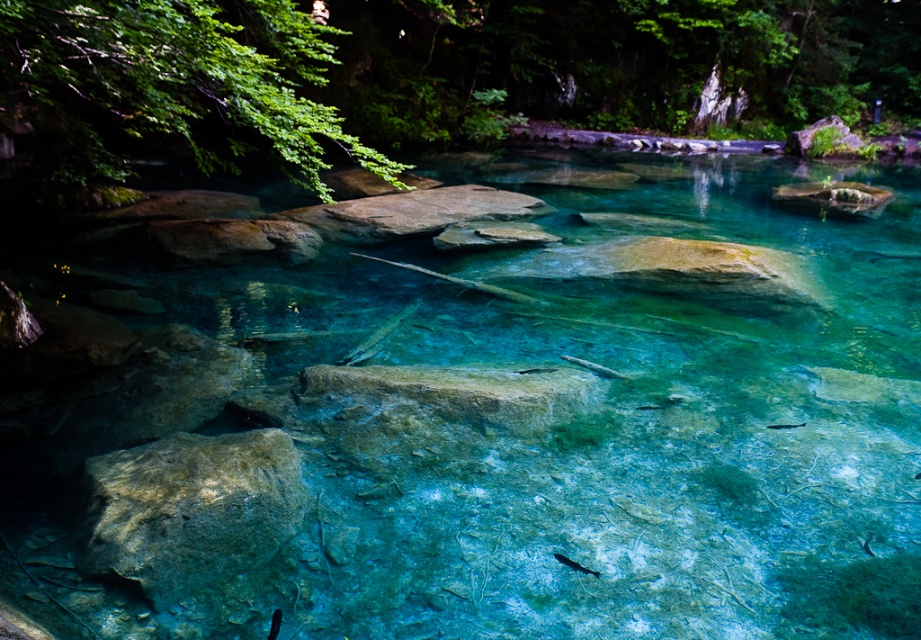
You are a snorkeler swimming in the water. You see a translucent rock at lower left and a shiny blue fish at center. Which object is closer to the surface of the water?

The translucent rock at lower left is located above the shiny blue fish at center, so it is closer to the surface of the water.

You are a snorkeler swimming in the water and want to catch both the shiny blue fish at center and the shiny silver fish at center. If your net can reach up to 1 meter, can you catch both fish with a single throw?

The distance between the shiny blue fish at center and the shiny silver fish at center is 1.19 meters. Since your net can only reach up to 1 meter, you cannot catch both fish with a single throw.

You are standing at the edge of the water in the scene and want to reach the point marked as point (189,509). Based on the description, what is the surface you will be stepping on when you reach that point?

The point (189,509) is on translucent rock at lower left, so the surface you will be stepping on is translucent rock.